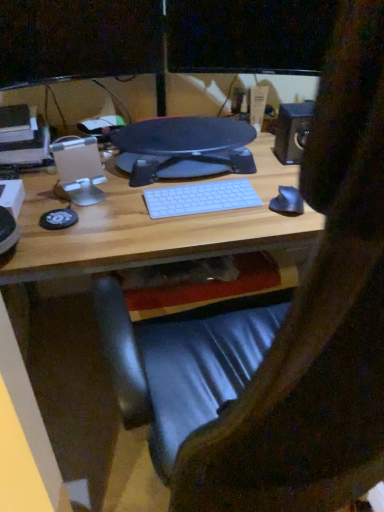
Question: Can you confirm if wooden desk at center is thinner than metallic black speaker at upper right?

Choices:
 (A) no
 (B) yes

Answer: (A)

Question: Considering the relative sizes of wooden desk at center and metallic black speaker at upper right in the image provided, is wooden desk at center taller than metallic black speaker at upper right?

Choices:
 (A) no
 (B) yes

Answer: (B)

Question: Can you confirm if wooden desk at center is smaller than metallic black speaker at upper right?

Choices:
 (A) yes
 (B) no

Answer: (B)

Question: Is wooden desk at center in contact with metallic black speaker at upper right?

Choices:
 (A) no
 (B) yes

Answer: (A)

Question: Would you say metallic black speaker at upper right is part of wooden desk at center's contents?

Choices:
 (A) yes
 (B) no

Answer: (B)

Question: Does wooden desk at center have a greater width compared to metallic black speaker at upper right?

Choices:
 (A) yes
 (B) no

Answer: (A)

Question: Is wooden desk at center oriented away from matte black monitor at upper center, which is counted as the 1th computer monitor, starting from the right?

Choices:
 (A) yes
 (B) no

Answer: (B)

Question: Considering the relative sizes of wooden desk at center and matte black monitor at upper center, which is counted as the 1th computer monitor, starting from the right, in the image provided, is wooden desk at center bigger than matte black monitor at upper center, which is counted as the 1th computer monitor, starting from the right,?

Choices:
 (A) no
 (B) yes

Answer: (B)

Question: Would you say wooden desk at center is outside matte black monitor at upper center, which is the 2th computer monitor from left to right?

Choices:
 (A) no
 (B) yes

Answer: (B)

Question: Does wooden desk at center have a lesser width compared to matte black monitor at upper center, which is counted as the 1th computer monitor, starting from the right?

Choices:
 (A) no
 (B) yes

Answer: (A)

Question: Is the position of wooden desk at center less distant than that of matte black monitor at upper center, which is the 2th computer monitor from left to right?

Choices:
 (A) no
 (B) yes

Answer: (B)

Question: Considering the relative sizes of wooden desk at center and matte black monitor at upper center, which is the 2th computer monitor from left to right, in the image provided, is wooden desk at center wider than matte black monitor at upper center, which is the 2th computer monitor from left to right,?

Choices:
 (A) no
 (B) yes

Answer: (B)

Question: Is matte black monitor at upper center, which is counted as the 1th computer monitor, starting from the right, at the left side of matte black monitor at upper center, which appears as the 2th computer monitor when viewed from the right?

Choices:
 (A) no
 (B) yes

Answer: (A)